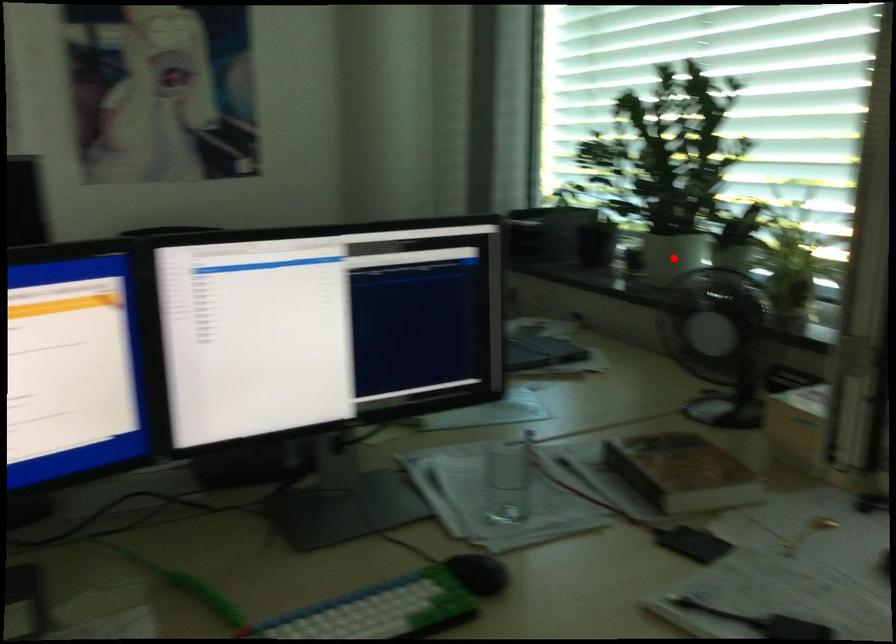
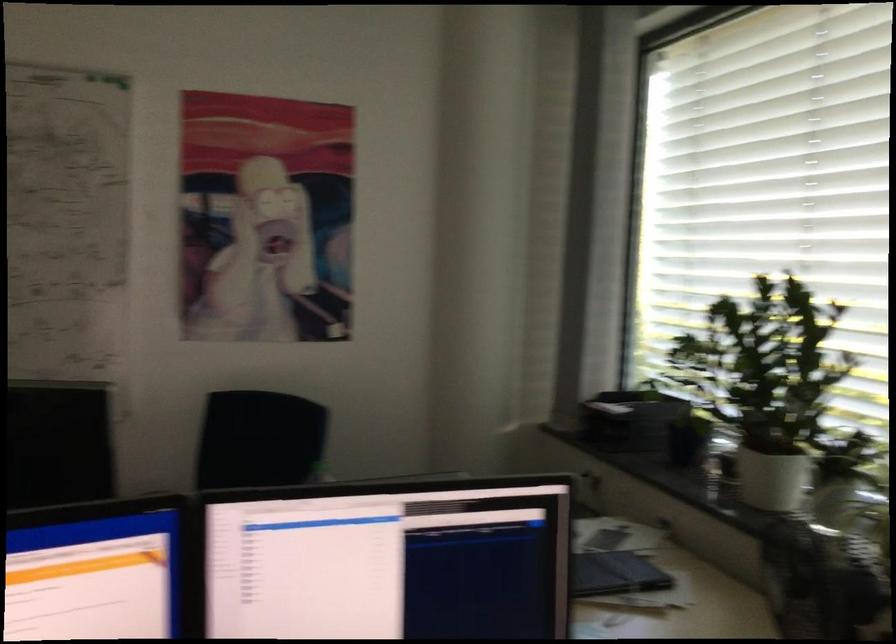
In the second image, find the point that corresponds to the highlighted location in the first image.

(770, 478)